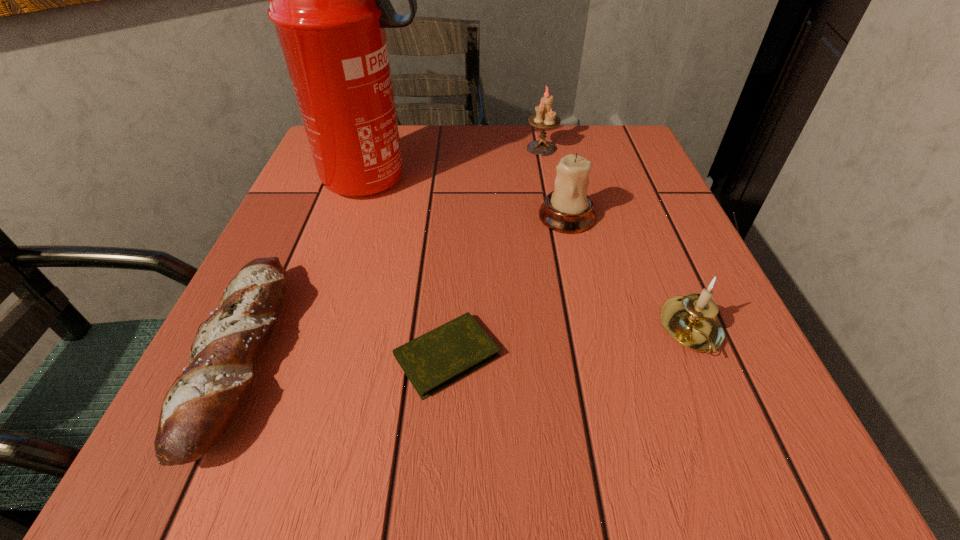
At what (x,y) coordinates should I click in order to perform the action: click on the tallest object. Please return your answer as a coordinate pair (x, y). This screenshot has height=540, width=960. Looking at the image, I should click on (329, 0).

Locate an element on the screen. This screenshot has height=540, width=960. the farthest object is located at coordinates (545, 118).

Identify the location of the second farthest candle holder. The height and width of the screenshot is (540, 960). (568, 209).

You are a GUI agent. You are given a task and a screenshot of the screen. Output one action in this format:
    pyautogui.click(x=<x>, y=<y>)
    Task: Click on the rightmost candle holder
    This screenshot has height=540, width=960.
    Given the screenshot: What is the action you would take?
    pyautogui.click(x=691, y=320)

In order to click on the fourth tallest object in this screenshot , I will do `click(691, 320)`.

Identify the location of baguet. This screenshot has height=540, width=960. (200, 405).

Image resolution: width=960 pixels, height=540 pixels. I want to click on the shortest object, so click(x=438, y=358).

In order to click on vacant space situated 0.210m on the trigger side of the fire extinguisher in this screenshot , I will do `click(529, 180)`.

Identify the location of vacant area located 0.070m on the right of the farthest candle holder. (587, 148).

You are a GUI agent. You are given a task and a screenshot of the screen. Output one action in this format:
    pyautogui.click(x=<x>, y=<y>)
    Task: Click on the vacant space positioned on the front of the second nearest candle holder
    This screenshot has height=540, width=960.
    Given the screenshot: What is the action you would take?
    pyautogui.click(x=584, y=289)